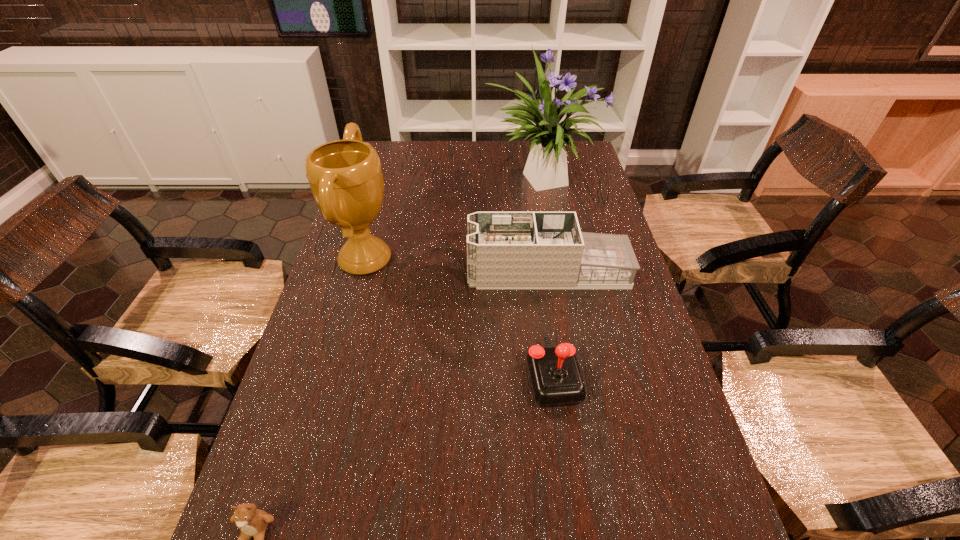
In order to click on free space located on the left of the joystick in this screenshot , I will do `click(409, 376)`.

At what (x,y) coordinates should I click in order to perform the action: click on object positioned at the far edge. Please return your answer as a coordinate pair (x, y). The height and width of the screenshot is (540, 960). Looking at the image, I should click on (546, 167).

Find the location of a particular element. The width and height of the screenshot is (960, 540). object located in the left edge section of the desktop is located at coordinates (345, 176).

I want to click on flower arrangement positioned at the right edge, so pyautogui.click(x=546, y=167).

This screenshot has height=540, width=960. Identify the location of dollhouse at the right edge. (505, 250).

Image resolution: width=960 pixels, height=540 pixels. I want to click on object present at the far right corner, so click(546, 167).

Find the location of a particular element. The width and height of the screenshot is (960, 540). vacant point at the far edge is located at coordinates (474, 150).

You are a GUI agent. You are given a task and a screenshot of the screen. Output one action in this format:
    pyautogui.click(x=<x>, y=<y>)
    Task: Click on the vacant region at the left edge of the desktop
    The height and width of the screenshot is (540, 960).
    Given the screenshot: What is the action you would take?
    pyautogui.click(x=396, y=224)

In the image, there is a desktop. Find the location of `blank space at the right edge`. blank space at the right edge is located at coordinates (600, 202).

Locate an element on the screen. The image size is (960, 540). free point at the far left corner is located at coordinates (408, 148).